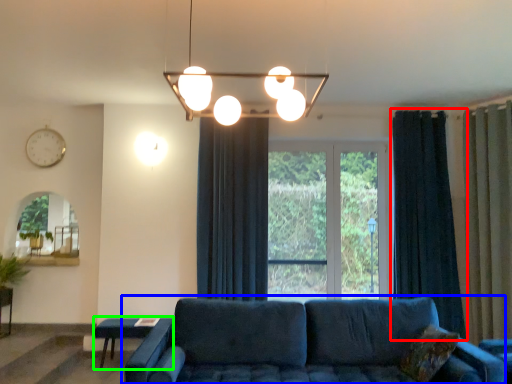
Question: Which is nearer to the curtain (highlighted by a red box)? studio couch (highlighted by a blue box) or table (highlighted by a green box).

Choices:
 (A) studio couch
 (B) table

Answer: (A)